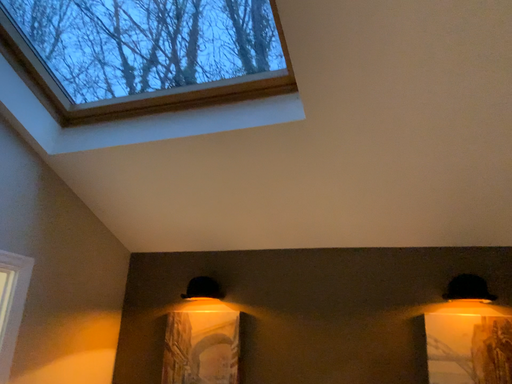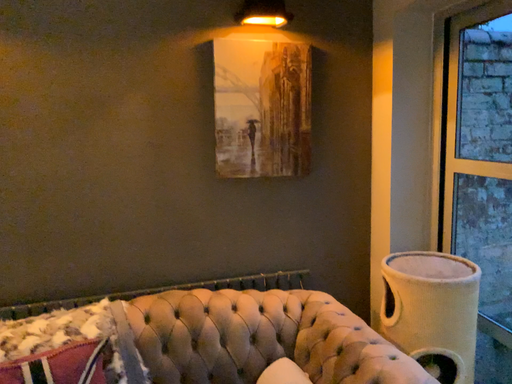
Question: Which way did the camera rotate in the video?

Choices:
 (A) rotated upward
 (B) rotated downward

Answer: (B)